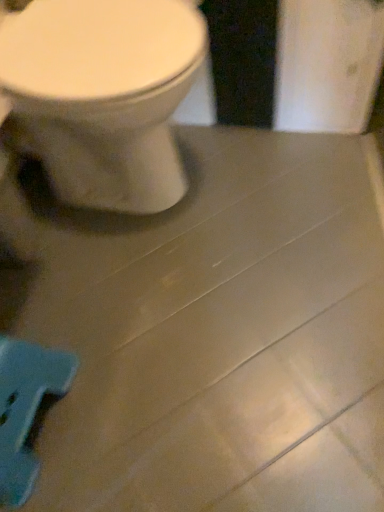
Question: Does white glossy toilet at upper left have a smaller size compared to blue plastic toy at lower left?

Choices:
 (A) no
 (B) yes

Answer: (A)

Question: Is the position of white glossy toilet at upper left less distant than that of blue plastic toy at lower left?

Choices:
 (A) no
 (B) yes

Answer: (B)

Question: Can you confirm if white glossy toilet at upper left is shorter than blue plastic toy at lower left?

Choices:
 (A) no
 (B) yes

Answer: (A)

Question: Is white glossy toilet at upper left not within blue plastic toy at lower left?

Choices:
 (A) yes
 (B) no

Answer: (A)

Question: Is white glossy toilet at upper left taller than blue plastic toy at lower left?

Choices:
 (A) yes
 (B) no

Answer: (A)

Question: Is blue plastic toy at lower left inside white glossy toilet at upper left?

Choices:
 (A) no
 (B) yes

Answer: (A)

Question: Is blue plastic toy at lower left positioned beyond the bounds of white glossy toilet at upper left?

Choices:
 (A) no
 (B) yes

Answer: (B)

Question: Could you tell me if blue plastic toy at lower left is facing white glossy toilet at upper left?

Choices:
 (A) no
 (B) yes

Answer: (A)

Question: Is the depth of blue plastic toy at lower left greater than that of white glossy toilet at upper left?

Choices:
 (A) no
 (B) yes

Answer: (B)

Question: Is blue plastic toy at lower left shorter than white glossy toilet at upper left?

Choices:
 (A) no
 (B) yes

Answer: (B)

Question: Considering the relative positions of blue plastic toy at lower left and white glossy toilet at upper left in the image provided, is blue plastic toy at lower left to the left of white glossy toilet at upper left from the viewer's perspective?

Choices:
 (A) no
 (B) yes

Answer: (B)

Question: Can you confirm if blue plastic toy at lower left is thinner than white glossy toilet at upper left?

Choices:
 (A) yes
 (B) no

Answer: (A)

Question: Considering the positions of white glossy toilet at upper left and blue plastic toy at lower left in the image, is white glossy toilet at upper left taller or shorter than blue plastic toy at lower left?

Choices:
 (A) short
 (B) tall

Answer: (B)